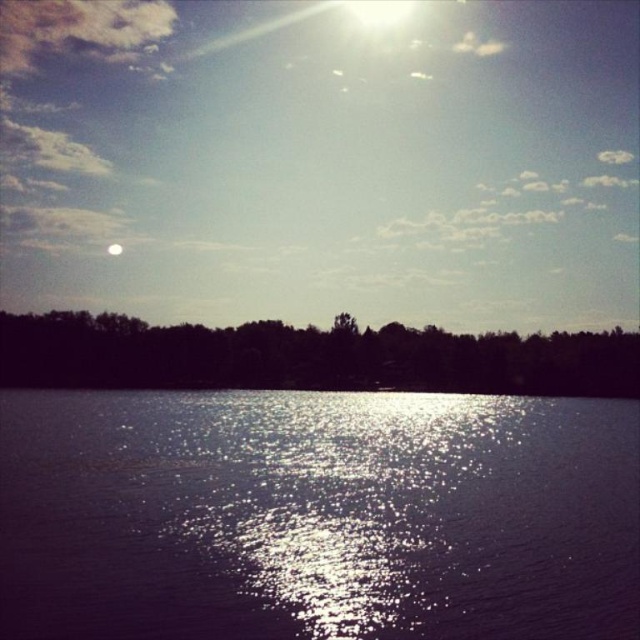
Question: Which is farther from the glistening reflective water at center?

Choices:
 (A) white glossy moon at upper center
 (B) silhouette leafy trees at center

Answer: (A)

Question: Does silhouette leafy trees at center appear on the left side of white glossy moon at upper center?

Choices:
 (A) yes
 (B) no

Answer: (B)

Question: Does silhouette leafy trees at center appear on the right side of white glossy moon at upper center?

Choices:
 (A) no
 (B) yes

Answer: (B)

Question: In this image, where is glistening reflective water at center located relative to white glossy moon at upper center?

Choices:
 (A) right
 (B) left

Answer: (A)

Question: Among these objects, which one is farthest from the camera?

Choices:
 (A) silhouette leafy trees at center
 (B) glistening reflective water at center
 (C) white glossy moon at upper center

Answer: (C)

Question: Which of the following is the farthest from the observer?

Choices:
 (A) silhouette leafy trees at center
 (B) white glossy moon at upper center

Answer: (B)